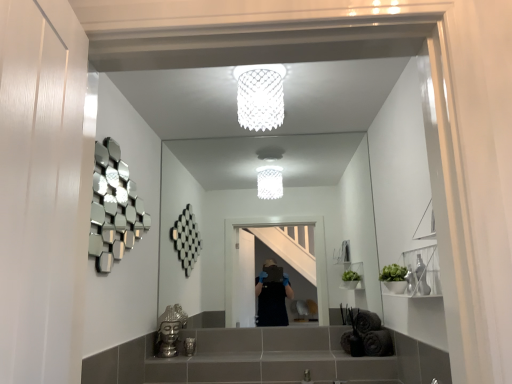
Image resolution: width=512 pixels, height=384 pixels. Describe the element at coordinates (260, 96) in the screenshot. I see `white mesh light fixture at upper center` at that location.

Locate an element on the screen. The image size is (512, 384). metallic silver toiletry at lower center is located at coordinates [189, 346].

This screenshot has height=384, width=512. What do you see at coordinates (170, 330) in the screenshot? I see `gold metallic buddha head at lower center` at bounding box center [170, 330].

Describe the element at coordinates (261, 216) in the screenshot. The height and width of the screenshot is (384, 512). I see `clear glass mirror at center` at that location.

The height and width of the screenshot is (384, 512). Find the location of `white mesh light fixture at upper center`. white mesh light fixture at upper center is located at coordinates (260, 96).

Identify the location of toiletry that is under the white mesh light fixture at upper center (from a real-world perspective). (189, 346).

Could you measure the distance between white mesh light fixture at upper center and metallic silver toiletry at lower center?

A distance of 4.98 feet exists between white mesh light fixture at upper center and metallic silver toiletry at lower center.

Which object is closer to the camera, white mesh light fixture at upper center or metallic silver toiletry at lower center?

white mesh light fixture at upper center.

Between white mesh light fixture at upper center and metallic silver toiletry at lower center, which one has smaller size?

Smaller between the two is metallic silver toiletry at lower center.

From the image's perspective, between metallic silver toiletry at lower center and clear glass mirror at center, who is located below?

metallic silver toiletry at lower center.

You are a GUI agent. You are given a task and a screenshot of the screen. Output one action in this format:
    pyautogui.click(x=<x>, y=<y>)
    Task: Click on the toiletry that is below the clear glass mirror at center (from the image's perspective)
    The width and height of the screenshot is (512, 384).
    Given the screenshot: What is the action you would take?
    pyautogui.click(x=189, y=346)

Is metallic silver toiletry at lower center bigger than clear glass mirror at center?

No, metallic silver toiletry at lower center is not bigger than clear glass mirror at center.

Is metallic silver toiletry at lower center not near clear glass mirror at center?

Yes.

Is white mesh light fixture at upper center closer to the viewer compared to clear glass mirror at center?

Yes, the depth of white mesh light fixture at upper center is less than that of clear glass mirror at center.

Considering the positions of objects white mesh light fixture at upper center and clear glass mirror at center in the image provided, who is more to the left, white mesh light fixture at upper center or clear glass mirror at center?

white mesh light fixture at upper center.

Considering the sizes of objects white mesh light fixture at upper center and clear glass mirror at center in the image provided, who is taller, white mesh light fixture at upper center or clear glass mirror at center?

With more height is clear glass mirror at center.

In the scene shown: From the image's perspective, is metallic silver toiletry at lower center located above gold metallic buddha head at lower center?

Actually, metallic silver toiletry at lower center appears below gold metallic buddha head at lower center in the image.

Consider the image. Is metallic silver toiletry at lower center positioned behind gold metallic buddha head at lower center?

Yes, it is.

Does metallic silver toiletry at lower center have a greater height compared to gold metallic buddha head at lower center?

No.

Is gold metallic buddha head at lower center smaller than clear glass mirror at center?

Indeed, gold metallic buddha head at lower center has a smaller size compared to clear glass mirror at center.

Consider the image. From the image's perspective, relative to clear glass mirror at center, is gold metallic buddha head at lower center above or below?

Based on their image positions, gold metallic buddha head at lower center is located beneath clear glass mirror at center.

Which is behind, point (176, 350) or point (325, 202)?

Point (325, 202)

The height and width of the screenshot is (384, 512). Find the location of `sink below the clear glass mirror at center (from a real-world perspective)`. sink below the clear glass mirror at center (from a real-world perspective) is located at coordinates (170, 330).

Could you tell me if white mesh light fixture at upper center is facing gold metallic buddha head at lower center?

No, white mesh light fixture at upper center does not turn towards gold metallic buddha head at lower center.

Does point (256, 98) come behind point (168, 331)?

No, (256, 98) is in front of (168, 331).

Which object is closer to the camera, white mesh light fixture at upper center or gold metallic buddha head at lower center?

white mesh light fixture at upper center.

From a real-world perspective, is clear glass mirror at center above or below gold metallic buddha head at lower center?

In terms of real-world spatial position, clear glass mirror at center is above gold metallic buddha head at lower center.

In order to click on sink that appears below the clear glass mirror at center (from the image's perspective) in this screenshot , I will do `click(170, 330)`.

Based on the photo, is clear glass mirror at center far from gold metallic buddha head at lower center?

clear glass mirror at center is far away from gold metallic buddha head at lower center.

Image resolution: width=512 pixels, height=384 pixels. I want to click on light fixture located on the right of metallic silver toiletry at lower center, so [x=260, y=96].

Where is `toiletry below the clear glass mirror at center (from a real-world perspective)`? This screenshot has height=384, width=512. toiletry below the clear glass mirror at center (from a real-world perspective) is located at coordinates (189, 346).

Which object lies further to the anchor point white mesh light fixture at upper center, metallic silver toiletry at lower center or gold metallic buddha head at lower center?

Based on the image, metallic silver toiletry at lower center appears to be further to white mesh light fixture at upper center.

From the image, which object appears to be farther from clear glass mirror at center, gold metallic buddha head at lower center or white mesh light fixture at upper center?

white mesh light fixture at upper center is further to clear glass mirror at center.

Based on their spatial positions, is clear glass mirror at center or gold metallic buddha head at lower center closer to white mesh light fixture at upper center?

gold metallic buddha head at lower center.

From the image, which object appears to be farther from metallic silver toiletry at lower center, gold metallic buddha head at lower center or clear glass mirror at center?

clear glass mirror at center.

Estimate the real-world distances between objects in this image. Which object is closer to metallic silver toiletry at lower center, clear glass mirror at center or white mesh light fixture at upper center?

white mesh light fixture at upper center lies closer to metallic silver toiletry at lower center than the other object.

Based on their spatial positions, is white mesh light fixture at upper center or metallic silver toiletry at lower center closer to gold metallic buddha head at lower center?

Based on the image, metallic silver toiletry at lower center appears to be nearer to gold metallic buddha head at lower center.

Considering their positions, is clear glass mirror at center positioned further to white mesh light fixture at upper center than metallic silver toiletry at lower center?

metallic silver toiletry at lower center is positioned further to the anchor white mesh light fixture at upper center.

Based on the photo, when comparing their distances from gold metallic buddha head at lower center, does white mesh light fixture at upper center or clear glass mirror at center seem further?

The object further to gold metallic buddha head at lower center is white mesh light fixture at upper center.

The height and width of the screenshot is (384, 512). I want to click on sink between clear glass mirror at center and metallic silver toiletry at lower center vertically, so click(x=170, y=330).

Identify the location of sink that lies between white mesh light fixture at upper center and metallic silver toiletry at lower center from top to bottom. This screenshot has width=512, height=384. (170, 330).

Image resolution: width=512 pixels, height=384 pixels. I want to click on mirror between white mesh light fixture at upper center and gold metallic buddha head at lower center in the vertical direction, so point(261,216).

Locate an element on the screen. mirror between white mesh light fixture at upper center and metallic silver toiletry at lower center in the up-down direction is located at coordinates (261, 216).